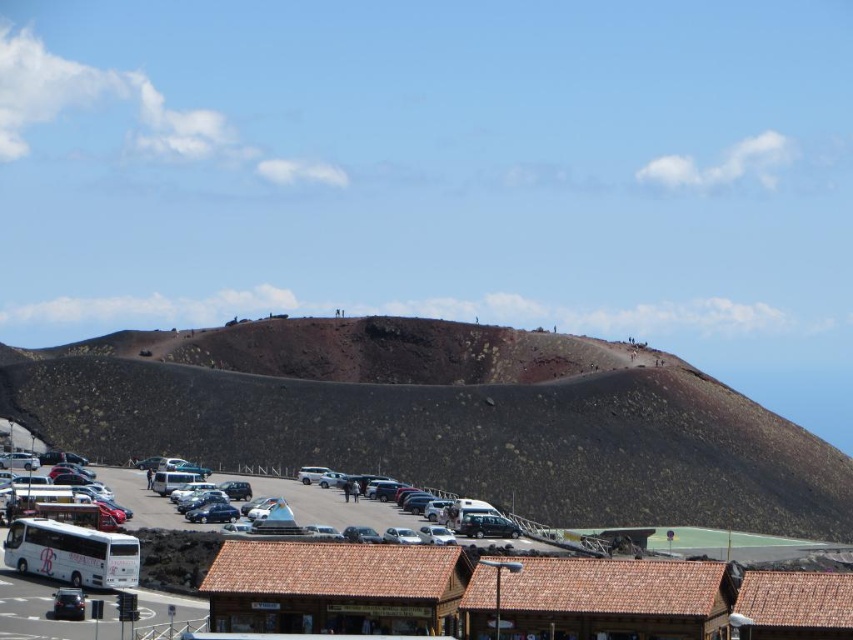
You are standing in the parking lot and want to take a photo of the volcanic rock mountain at upper center and the white matte bus at center. Which object should you focus on first to ensure both are in the frame?

You should focus on the white matte bus at center first because the volcanic rock mountain at upper center is further away, so adjusting focus starting from the closer object ensures both are in the frame.

You are standing in the parking lot and want to walk towards the volcanic terrain. Which point, point (410, 452) or point (100, 573), is closer to you as you start walking?

Point (410, 452) is closer to you because it is further to the viewer than point (100, 573), meaning it is nearer in the scene.